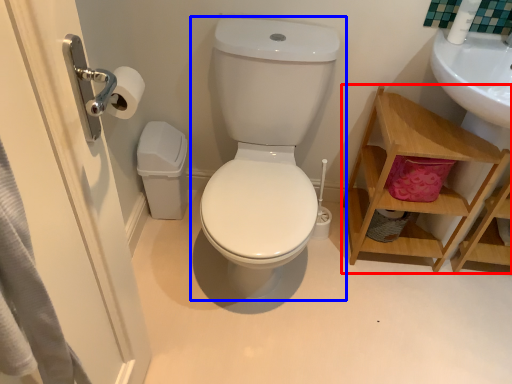
Question: Among these objects, which one is farthest to the camera, shelf (highlighted by a red box) or toilet (highlighted by a blue box)?

Choices:
 (A) shelf
 (B) toilet

Answer: (A)